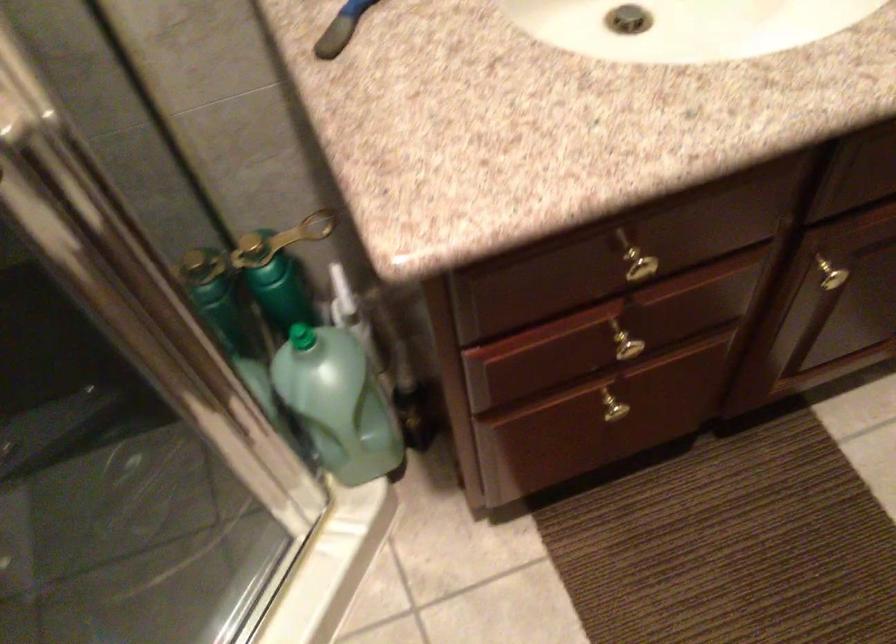
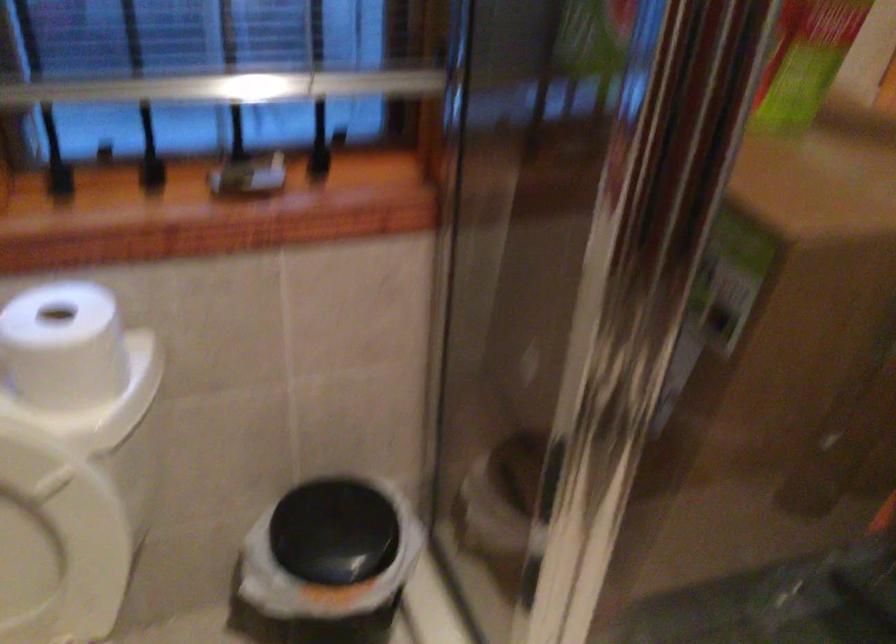
How did the camera likely rotate?

The camera's rotation is toward left-down.